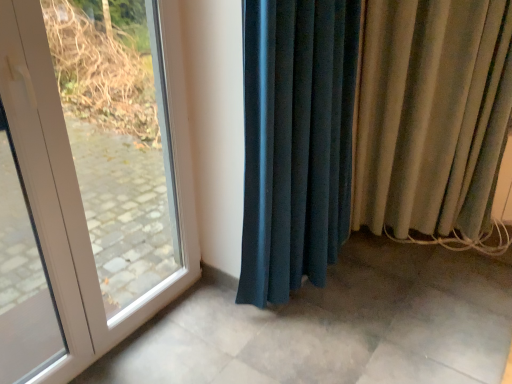
Question: Is beige velvet curtain at right, which is the first curtain from right to left, situated inside white glossy door at left or outside?

Choices:
 (A) outside
 (B) inside

Answer: (A)

Question: Is point (x=421, y=74) positioned closer to the camera than point (x=34, y=46)?

Choices:
 (A) closer
 (B) farther

Answer: (B)

Question: Which is farther from the white glossy door at left?

Choices:
 (A) beige velvet curtain at right, which is the first curtain from right to left
 (B) velvet teal curtain at center, the 2th curtain viewed from the right

Answer: (A)

Question: Which of these objects is positioned farthest from the velvet teal curtain at center, positioned as the 1th curtain in left-to-right order?

Choices:
 (A) beige velvet curtain at right, the second curtain from the left
 (B) white glossy door at left

Answer: (B)